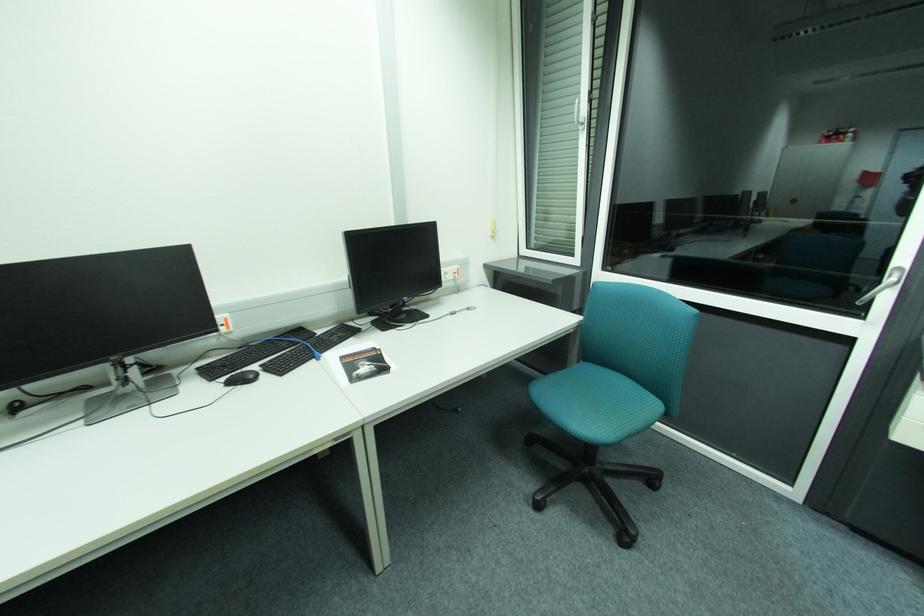
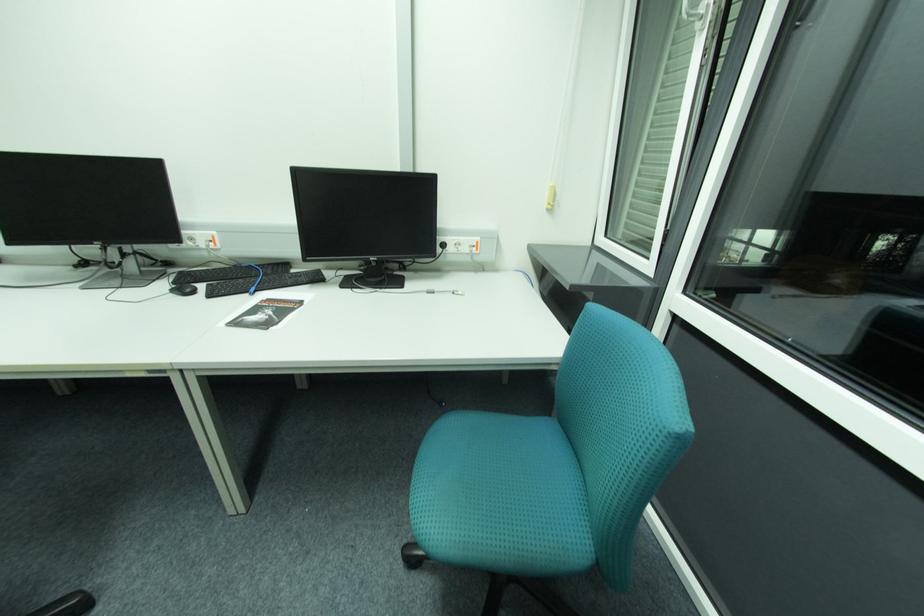
Question: The camera is either moving clockwise (left) or counter-clockwise (right) around the object. The first image is from the beginning of the video and the second image is from the end. Is the camera moving left or right when shooting the video?

Choices:
 (A) Left
 (B) Right

Answer: (B)